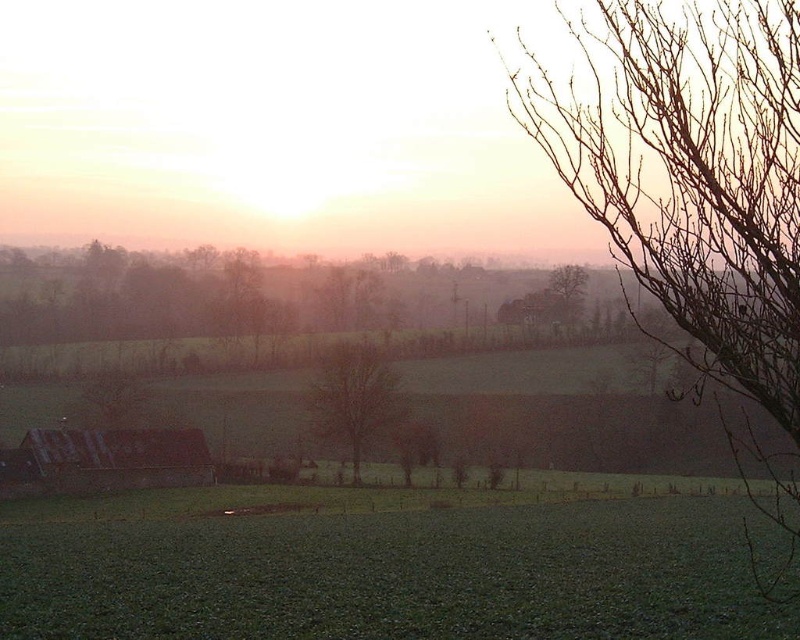
You are an artist sketching this scene. You want to draw the bare branches at upper right and the bare tree at center. Which one should you sketch first to maintain proper layering?

You should sketch the bare branches at upper right first because it is in front of the bare tree at center, so it needs to be drawn on top to maintain proper layering.

You are an astronomer analyzing the position of celestial objects in the image. Given that the sun is positioned at point 0.5 in the horizontal axis and 0.9 in the vertical axis, is the bare branches at upper right located to the east or west of the sun?

The bare branches at upper right is located at point 0.306 on the horizontal axis, while the sun is at 0.5. Since 0.306 is to the left of 0.5, the bare branches at upper right is west of the sun.